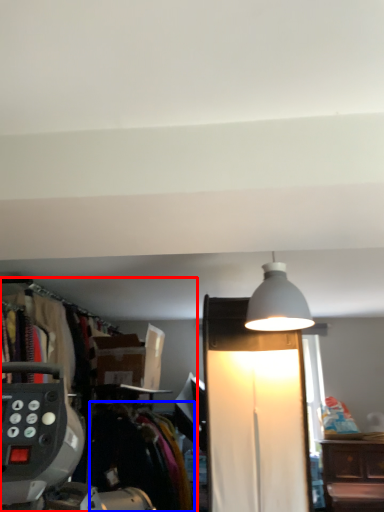
Question: Among these objects, which one is nearest to the camera, closet (highlighted by a red box) or clothing (highlighted by a blue box)?

Choices:
 (A) closet
 (B) clothing

Answer: (B)